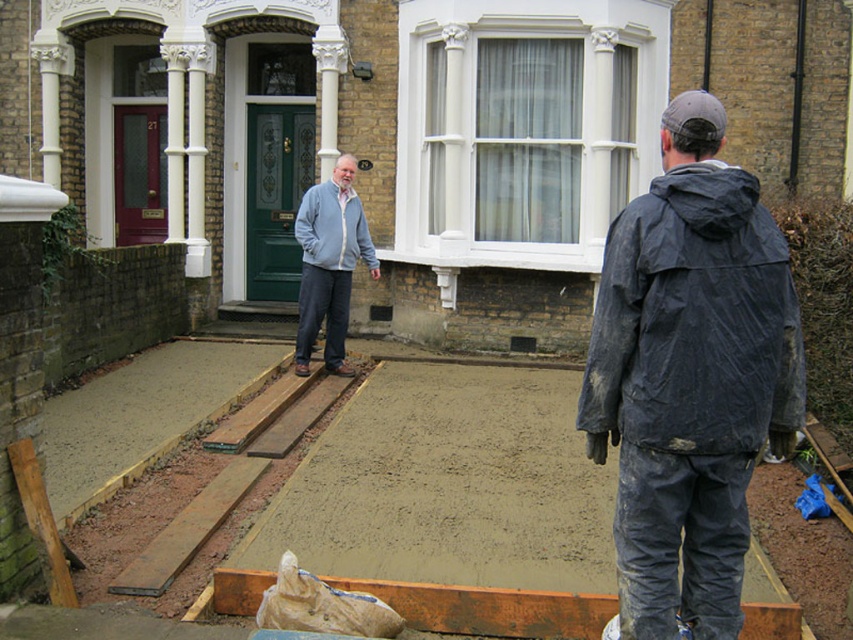
Question: Does smooth concrete at center appear on the right side of light gray fleece jacket at center?

Choices:
 (A) yes
 (B) no

Answer: (A)

Question: Which of the following is the farthest from the observer?

Choices:
 (A) (670, 451)
 (B) (323, 518)
 (C) (314, 304)
 (D) (321, 204)

Answer: (C)

Question: Which object is the farthest from the smooth concrete at center?

Choices:
 (A) light gray fleece jacket at center
 (B) light blue zip-up sweater at center
 (C) wet dark blue jacket at lower right

Answer: (A)

Question: Which object appears farthest from the camera in this image?

Choices:
 (A) smooth concrete at center
 (B) wet dark blue jacket at lower right

Answer: (A)

Question: Does smooth concrete at center appear on the right side of wet dark blue jacket at lower right?

Choices:
 (A) yes
 (B) no

Answer: (B)

Question: Is light blue zip-up sweater at center above light gray fleece jacket at center?

Choices:
 (A) no
 (B) yes

Answer: (A)